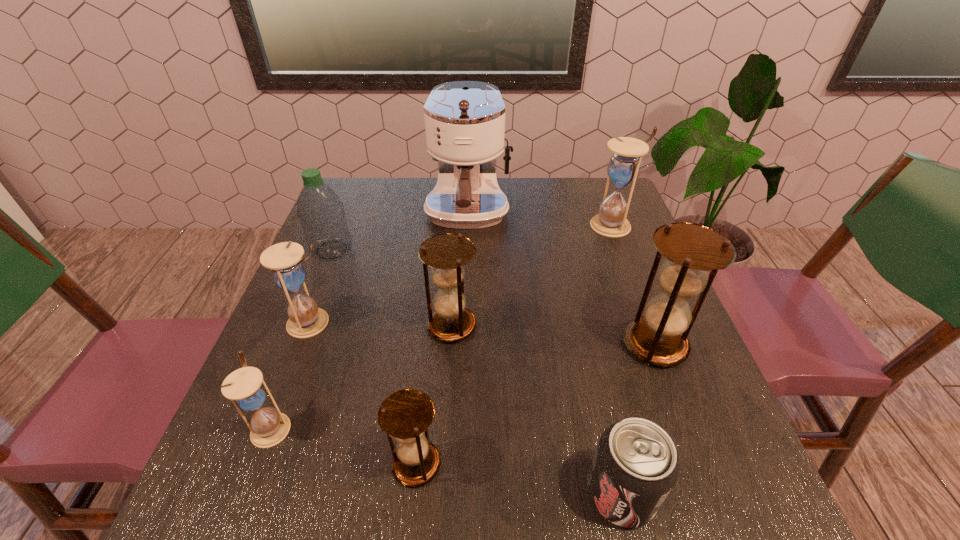
Locate which white hourglass is the third closest to the coffee maker. Please provide its 2D coordinates. Your answer should be formatted as a tuple, i.e. [(x, y)], where the tuple contains the x and y coordinates of a point satisfying the conditions above.

[(245, 387)]

Identify the location of brown hourglass that is the third closest to the green water bottle. (659, 337).

The width and height of the screenshot is (960, 540). I want to click on brown hourglass that stands as the closest to the third object from right to left, so click(x=659, y=337).

The image size is (960, 540). I want to click on vacant point that satisfies the following two spatial constraints: 1. on the front side of the green water bottle; 2. on the right side of the second nearest white hourglass, so click(302, 322).

In order to click on free spot that satisfies the following two spatial constraints: 1. on the front side of the third object from right to left; 2. on the right side of the second biggest brown hourglass in this screenshot , I will do `click(441, 493)`.